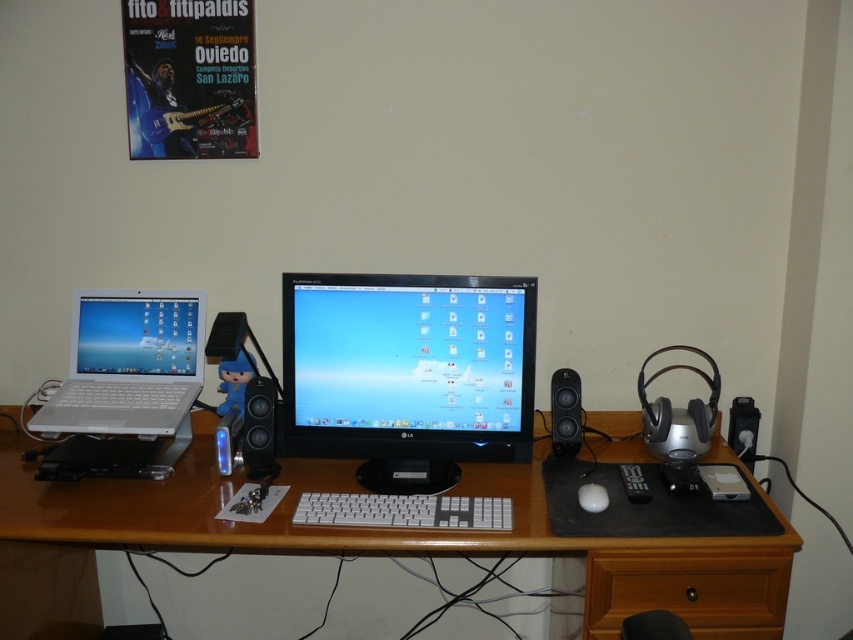
You need to place a new keyboard that is the same size as the wooden drawer at lower center on the desk. Can the white plastic laptop at left fit next to it without overlapping?

The white plastic laptop at left has a larger size compared to the wooden drawer at lower center. Since the keyboard is the same size as the wooden drawer, the laptop is bigger and may not fit next to it without overlapping.

You are setting up a new monitor stand and need to know the height difference between the matte white laptop at left and the white matte mouse at center. Which one is taller?

The matte white laptop at left is much taller than the white matte mouse at center.